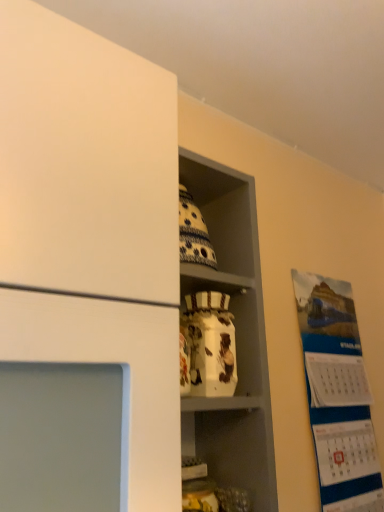
Question: Is white glossy vase at center shorter than white glossy jar at center?

Choices:
 (A) no
 (B) yes

Answer: (A)

Question: From a real-world perspective, is white glossy vase at center below white glossy jar at center?

Choices:
 (A) yes
 (B) no

Answer: (B)

Question: Is white glossy vase at center completely or partially outside of white glossy jar at center?

Choices:
 (A) yes
 (B) no

Answer: (A)

Question: Does white glossy vase at center lie behind white glossy jar at center?

Choices:
 (A) no
 (B) yes

Answer: (A)

Question: Is white glossy vase at center thinner than white glossy jar at center?

Choices:
 (A) yes
 (B) no

Answer: (B)

Question: Considering their positions, is white paper calendar at right located in front of or behind white glossy vase at center?

Choices:
 (A) front
 (B) behind

Answer: (B)

Question: Is white paper calendar at right wider or thinner than white glossy vase at center?

Choices:
 (A) thin
 (B) wide

Answer: (A)

Question: From a real-world perspective, is white paper calendar at right above or below white glossy vase at center?

Choices:
 (A) above
 (B) below

Answer: (B)

Question: Is point (321, 436) positioned closer to the camera than point (228, 239)?

Choices:
 (A) farther
 (B) closer

Answer: (A)

Question: In terms of width, does white glossy vase at center look wider or thinner when compared to white glossy jar at center?

Choices:
 (A) thin
 (B) wide

Answer: (B)

Question: Looking at the image, does white glossy vase at center seem bigger or smaller compared to white glossy jar at center?

Choices:
 (A) big
 (B) small

Answer: (A)

Question: Visually, is white glossy vase at center positioned to the left or to the right of white glossy jar at center?

Choices:
 (A) right
 (B) left

Answer: (B)

Question: Is point (258, 373) closer or farther from the camera than point (226, 276)?

Choices:
 (A) farther
 (B) closer

Answer: (B)

Question: Is white glossy jar at center in front of or behind white paper calendar at right in the image?

Choices:
 (A) front
 (B) behind

Answer: (A)

Question: Which is correct: white glossy jar at center is inside white paper calendar at right, or outside of it?

Choices:
 (A) outside
 (B) inside

Answer: (A)